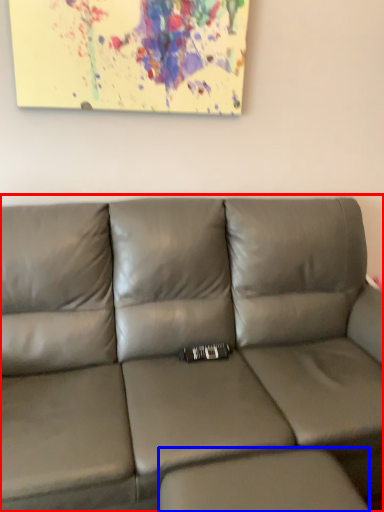
Question: Among these objects, which one is farthest to the camera, studio couch (highlighted by a red box) or footrest (highlighted by a blue box)?

Choices:
 (A) studio couch
 (B) footrest

Answer: (B)